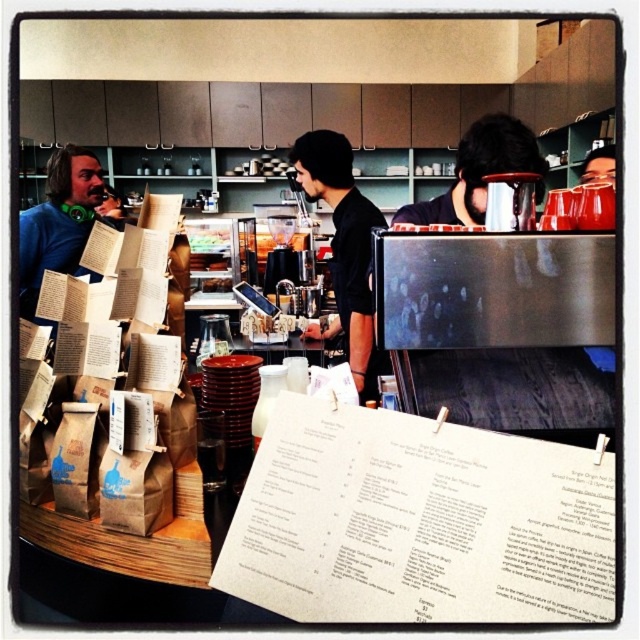
Which is below, white paper menu at center or black matte shirt at center?

white paper menu at center is lower down.

Can you confirm if white paper menu at center is positioned to the right of black matte shirt at center?

In fact, white paper menu at center is to the left of black matte shirt at center.

I want to click on white paper menu at center, so click(x=419, y=522).

This screenshot has height=640, width=640. I want to click on white paper menu at center, so click(419, 522).